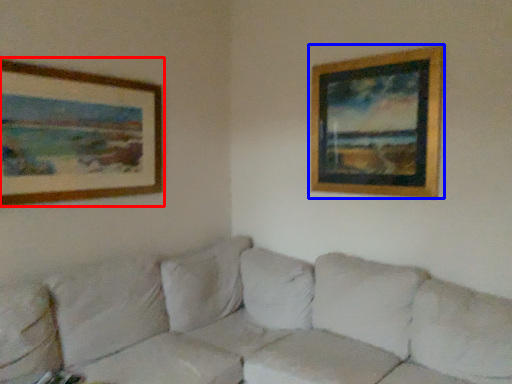
Question: Which object appears closest to the camera in this image, picture frame (highlighted by a red box) or picture frame (highlighted by a blue box)?

Choices:
 (A) picture frame
 (B) picture frame

Answer: (A)